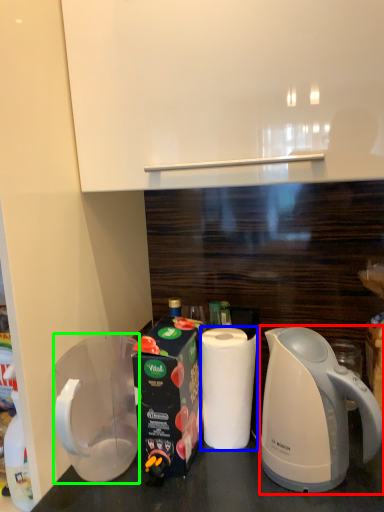
Question: Which is nearer to the kettle (highlighted by a red box)? paper towel (highlighted by a blue box) or pitcher (highlighted by a green box).

Choices:
 (A) paper towel
 (B) pitcher

Answer: (A)